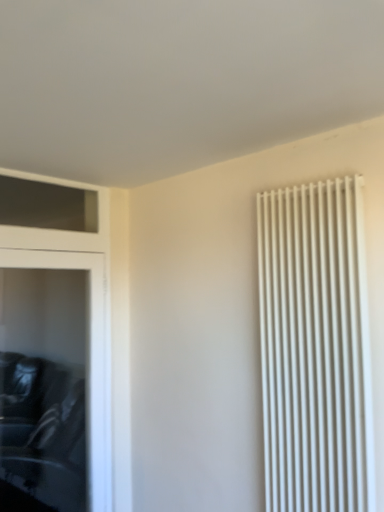
Question: Does black leather dresser at left have a greater width compared to white matte radiator at right?

Choices:
 (A) yes
 (B) no

Answer: (B)

Question: Is black leather dresser at left smaller than white matte radiator at right?

Choices:
 (A) no
 (B) yes

Answer: (A)

Question: Is black leather dresser at left facing towards white matte radiator at right?

Choices:
 (A) no
 (B) yes

Answer: (B)

Question: Would you say black leather dresser at left is a long distance from white matte radiator at right?

Choices:
 (A) yes
 (B) no

Answer: (A)

Question: Is black leather dresser at left shorter than white matte radiator at right?

Choices:
 (A) yes
 (B) no

Answer: (B)

Question: Is black leather dresser at left further to camera compared to white matte radiator at right?

Choices:
 (A) no
 (B) yes

Answer: (B)

Question: Considering the relative positions of white matte radiator at right and black leather dresser at left in the image provided, is white matte radiator at right behind black leather dresser at left?

Choices:
 (A) no
 (B) yes

Answer: (A)

Question: Considering the relative positions of white matte radiator at right and black leather dresser at left in the image provided, is white matte radiator at right to the right of black leather dresser at left from the viewer's perspective?

Choices:
 (A) yes
 (B) no

Answer: (A)

Question: Does white matte radiator at right lie in front of black leather dresser at left?

Choices:
 (A) no
 (B) yes

Answer: (B)

Question: Is white matte radiator at right not close to black leather dresser at left?

Choices:
 (A) no
 (B) yes

Answer: (B)

Question: Is white matte radiator at right oriented away from black leather dresser at left?

Choices:
 (A) yes
 (B) no

Answer: (B)

Question: From the image's perspective, is white matte radiator at right over black leather dresser at left?

Choices:
 (A) yes
 (B) no

Answer: (A)

Question: From a real-world perspective, is black leather dresser at left physically located above or below white matte radiator at right?

Choices:
 (A) below
 (B) above

Answer: (A)